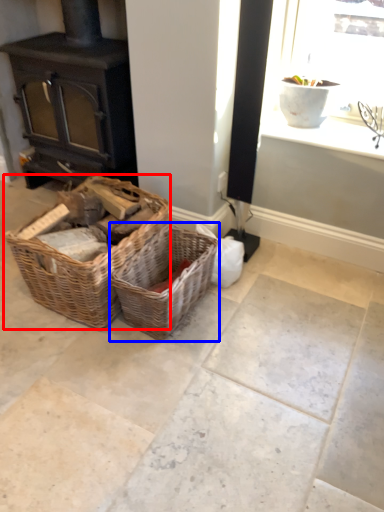
Question: Among these objects, which one is farthest to the camera, picnic basket (highlighted by a red box) or picnic basket (highlighted by a blue box)?

Choices:
 (A) picnic basket
 (B) picnic basket

Answer: (B)